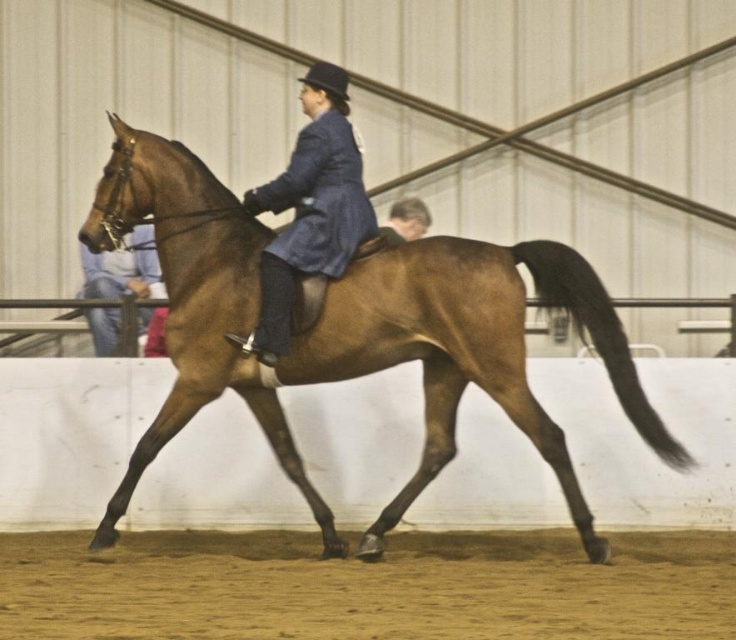
You are an equestrian judge observing the scene. You need to determine if the brown glossy horse at center is positioned correctly relative to the blue woolen coat at center. According to the arena rules, the horse must be directly beneath the rider. Is this the case here?

The brown glossy horse at center is located below blue woolen coat at center, so yes, the horse is positioned correctly beneath the rider as required by the arena rules.

You are an equestrian instructor observing the horse and rider in the arena. You notice two points marked in the scene. Which point is closer to you, point (252, 392) or point (364, 202)?

Point (252, 392) is further to the viewer than point (364, 202), so the closer point to you is point (364, 202).